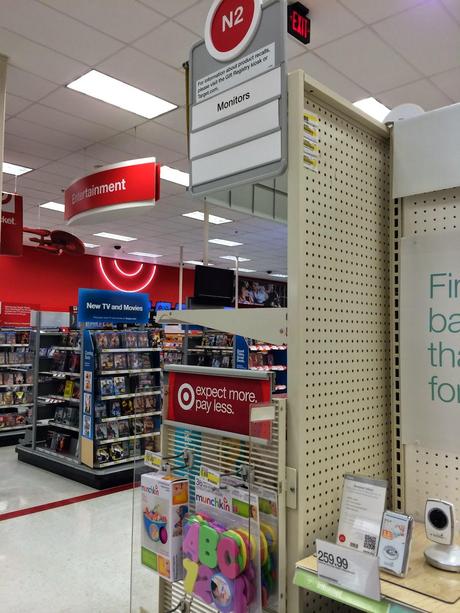
What are the coordinates of `ceiling` in the screenshot? It's located at (155, 223).